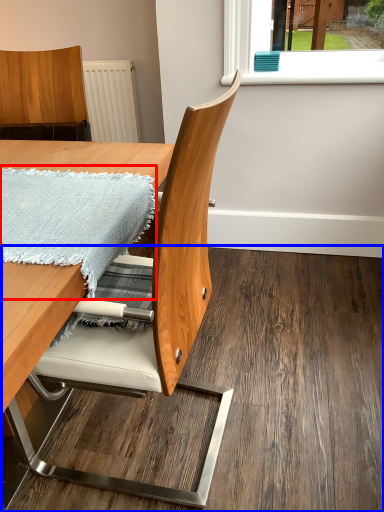
Question: Which object appears farthest to the camera in this image, blanket (highlighted by a red box) or plywood (highlighted by a blue box)?

Choices:
 (A) blanket
 (B) plywood

Answer: (B)